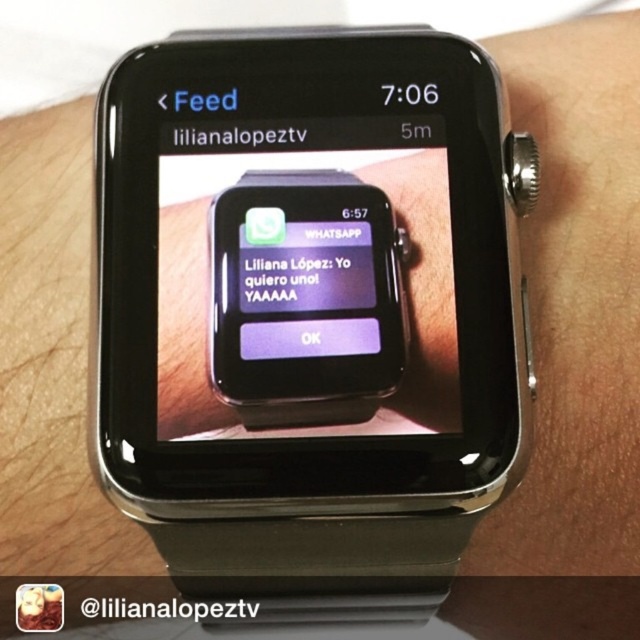
Is black matte watch face at center smaller than matte purple text at center?

Actually, black matte watch face at center might be larger than matte purple text at center.

Does black matte watch face at center appear on the right side of matte purple text at center?

Yes, black matte watch face at center is to the right of matte purple text at center.

Is point (440, 161) positioned in front of point (333, 304)?

No, it is not.

At what (x,y) coordinates should I click in order to perform the action: click on black matte watch face at center. Please return your answer as a coordinate pair (x, y). Image resolution: width=640 pixels, height=640 pixels. Looking at the image, I should click on (420, 296).

Locate an element on the screen. black matte watch face at center is located at coordinates (420, 296).

Is point (170, 298) behind point (285, 134)?

No.

Is point (198, 429) positioned after point (266, 131)?

That is False.

You are a GUI agent. You are given a task and a screenshot of the screen. Output one action in this format:
    pyautogui.click(x=<x>, y=<y>)
    Task: Click on the black matte watch face at center
    This screenshot has width=640, height=640.
    Given the screenshot: What is the action you would take?
    pyautogui.click(x=420, y=296)

Does black metallic smartwatch at center lie behind matte purple text at center?

No, black metallic smartwatch at center is closer to the viewer.

Between point (113, 337) and point (326, 307), which one is positioned in front?

Point (113, 337) is more forward.

Image resolution: width=640 pixels, height=640 pixels. Describe the element at coordinates (310, 312) in the screenshot. I see `black metallic smartwatch at center` at that location.

Find the location of `black metallic smartwatch at center`. black metallic smartwatch at center is located at coordinates (310, 312).